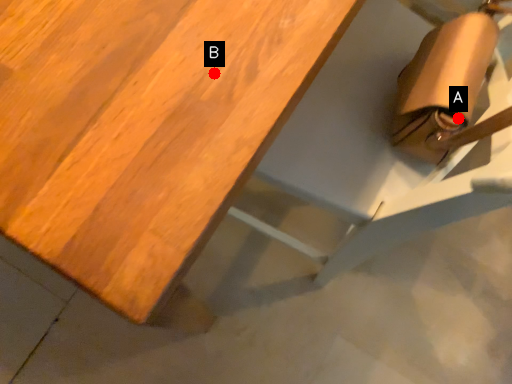
Question: Two points are circled on the image, labeled by A and B beside each circle. Which point is farther to the camera?

Choices:
 (A) A is further
 (B) B is further

Answer: (A)